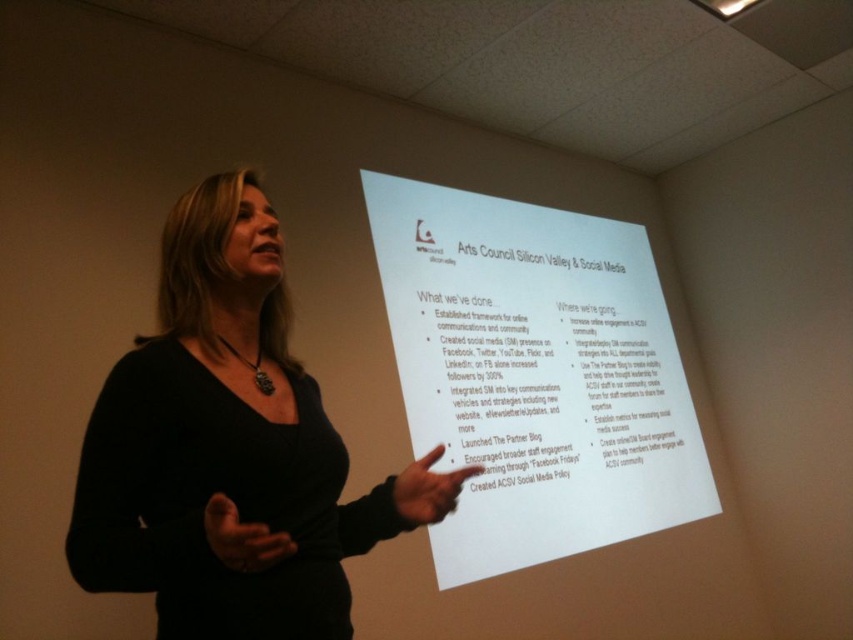
Looking at this image, the woman is standing in front of a projection screen. There is a point at coordinates (535, 374). What object is located at that point?

The point at coordinates (535, 374) corresponds to the white paper at center.

What is the position of the white paper at center in the image?

The white paper at center is located at point coordinates of 0.586 in the x axis and 0.628 in the y axis.